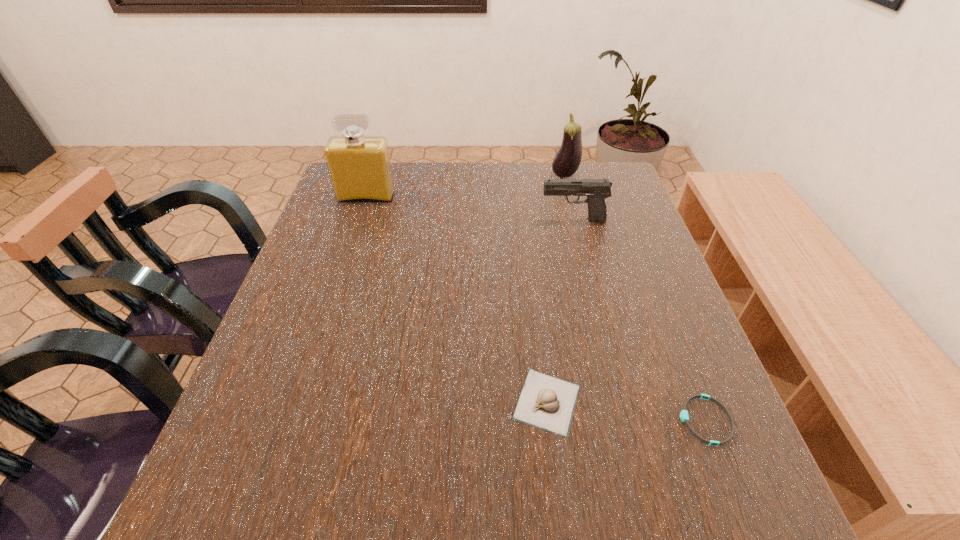
What are the coordinates of `the fourth nearest object` in the screenshot? It's located at (359, 167).

The height and width of the screenshot is (540, 960). I want to click on perfume, so click(x=359, y=167).

You are a GUI agent. You are given a task and a screenshot of the screen. Output one action in this format:
    pyautogui.click(x=<x>, y=<y>)
    Task: Click on the farthest object
    This screenshot has height=540, width=960.
    Given the screenshot: What is the action you would take?
    pyautogui.click(x=566, y=162)

This screenshot has width=960, height=540. Find the location of `the second tallest object`. the second tallest object is located at coordinates (566, 162).

Find the location of `pistol`. pistol is located at coordinates (597, 190).

Locate an element on the screen. This screenshot has height=540, width=960. the third farthest object is located at coordinates (597, 190).

At what (x,y) coordinates should I click in order to perform the action: click on the second shortest object. Please return your answer as a coordinate pair (x, y). Looking at the image, I should click on (546, 402).

Where is `wristband`? wristband is located at coordinates (684, 417).

Identify the location of the rightmost object. (684, 417).

Identify the location of vacant point located 0.170m on the front-facing side of the tallest object. (351, 243).